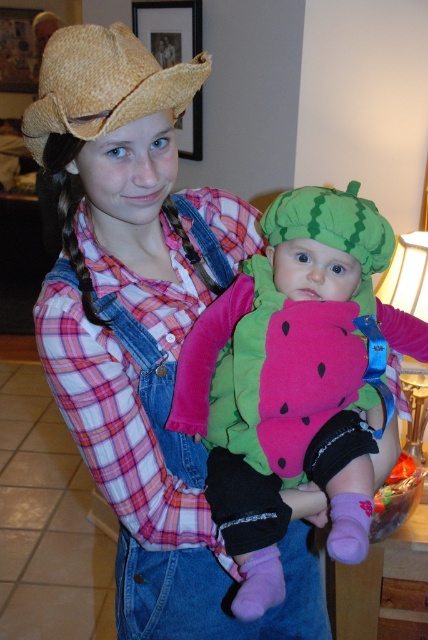
What object is located at the point coordinates of (143, 330) in the image?

The point coordinates of (143, 330) indicate the denim overall at center.

You are a photographer trying to capture a clear photo of the soft pink fabric watermelon at center and the straw hat at upper left. Since the camera can only focus on one object at a time, which object should you choose to ensure the larger one is in focus?

The soft pink fabric watermelon at center should be focused on because it has a larger size compared to the straw hat at upper left.

You are a photographer trying to capture a photo of the denim overall at center and the soft pink fabric watermelon at center. Which object should you focus on first if you want to ensure both are in focus?

The denim overall at center is below the soft pink fabric watermelon at center, so you should focus on the soft pink fabric watermelon at center first to ensure both are in focus.